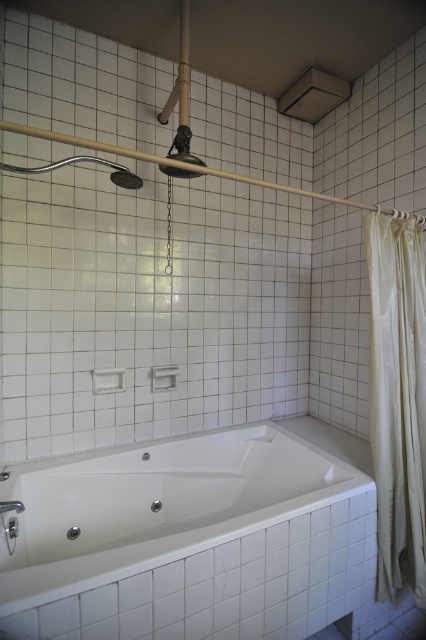
Does white glossy bathtub at lower center have a larger size compared to white plastic towel bar at center?

Correct, white glossy bathtub at lower center is larger in size than white plastic towel bar at center.

Is white glossy bathtub at lower center above white plastic towel bar at center?

No, white glossy bathtub at lower center is not above white plastic towel bar at center.

Where is `white glossy bathtub at lower center`? white glossy bathtub at lower center is located at coordinates (189, 540).

Is white plastic towel bar at center taller than matte silver towel bar at center?

Incorrect, white plastic towel bar at center's height is not larger of matte silver towel bar at center's.

Does point (98, 390) lie behind point (169, 380)?

No, (98, 390) is closer to viewer.

Which is behind, point (92, 376) or point (152, 376)?

The point (152, 376) is more distant.

Locate an element on the screen. The width and height of the screenshot is (426, 640). white plastic towel bar at center is located at coordinates (108, 380).

Is beige fabric shower curtain at right positioned before polished chrome showerhead at upper center?

No, beige fabric shower curtain at right is behind polished chrome showerhead at upper center.

What do you see at coordinates (397, 401) in the screenshot? The image size is (426, 640). I see `beige fabric shower curtain at right` at bounding box center [397, 401].

In order to click on beige fabric shower curtain at right in this screenshot , I will do `click(397, 401)`.